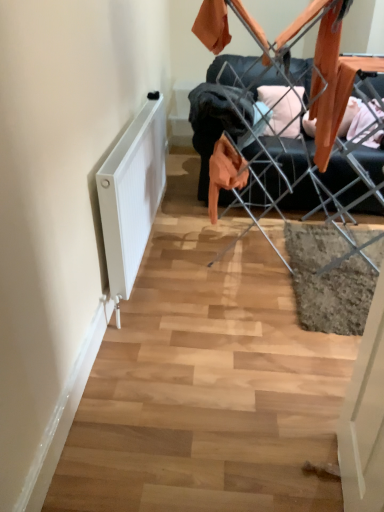
Question: From a real-world perspective, is white matte radiator at lower left beneath metal wire laundry rack at center?

Choices:
 (A) yes
 (B) no

Answer: (A)

Question: Does white matte radiator at lower left have a smaller size compared to metal wire laundry rack at center?

Choices:
 (A) no
 (B) yes

Answer: (B)

Question: Is white matte radiator at lower left bigger than metal wire laundry rack at center?

Choices:
 (A) no
 (B) yes

Answer: (A)

Question: Is white matte radiator at lower left positioned behind metal wire laundry rack at center?

Choices:
 (A) yes
 (B) no

Answer: (B)

Question: Is white matte radiator at lower left to the right of metal wire laundry rack at center from the viewer's perspective?

Choices:
 (A) no
 (B) yes

Answer: (A)

Question: From the image's perspective, is white matte radiator at lower left over metal wire laundry rack at center?

Choices:
 (A) no
 (B) yes

Answer: (A)

Question: Would you say white matte radiator at lower left is part of metal wire laundry rack at center's contents?

Choices:
 (A) yes
 (B) no

Answer: (B)

Question: Considering the relative sizes of metal wire laundry rack at center and white matte radiator at lower left in the image provided, is metal wire laundry rack at center wider than white matte radiator at lower left?

Choices:
 (A) no
 (B) yes

Answer: (B)

Question: Is metal wire laundry rack at center shorter than white matte radiator at lower left?

Choices:
 (A) yes
 (B) no

Answer: (B)

Question: Does metal wire laundry rack at center come in front of white matte radiator at lower left?

Choices:
 (A) no
 (B) yes

Answer: (A)

Question: From the image's perspective, does metal wire laundry rack at center appear lower than white matte radiator at lower left?

Choices:
 (A) no
 (B) yes

Answer: (A)

Question: Is metal wire laundry rack at center positioned beyond the bounds of white matte radiator at lower left?

Choices:
 (A) yes
 (B) no

Answer: (A)

Question: Is white matte radiator at lower left taller or shorter than metal wire laundry rack at center?

Choices:
 (A) short
 (B) tall

Answer: (A)